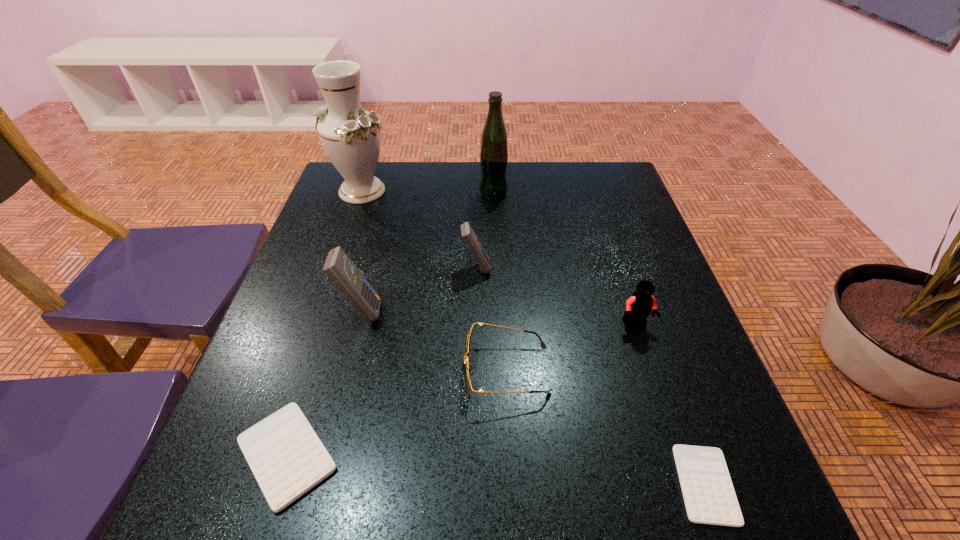
Locate an element on the screen. The image size is (960, 540). object situated at the near left corner is located at coordinates (287, 458).

You are a GUI agent. You are given a task and a screenshot of the screen. Output one action in this format:
    pyautogui.click(x=<x>, y=<y>)
    Task: Click on the object present at the near right corner
    This screenshot has height=540, width=960.
    Given the screenshot: What is the action you would take?
    pyautogui.click(x=709, y=496)

You are a GUI agent. You are given a task and a screenshot of the screen. Output one action in this format:
    pyautogui.click(x=<x>, y=<y>)
    Task: Click on the vacant space at the far edge of the desktop
    
    Given the screenshot: What is the action you would take?
    450,163

Where is `free space at the near edge`? The height and width of the screenshot is (540, 960). free space at the near edge is located at coordinates (507, 516).

In the image, there is a desktop. At what (x,y) coordinates should I click in order to perform the action: click on vacant space at the left edge. Please return your answer as a coordinate pair (x, y). Looking at the image, I should click on (248, 377).

Locate an element on the screen. The width and height of the screenshot is (960, 540). free region at the right edge is located at coordinates (635, 347).

Find the location of a particular element. vacant space at the far left corner of the desktop is located at coordinates (335, 177).

In the image, there is a desktop. What are the coordinates of `free space at the far right corner` in the screenshot? It's located at (627, 198).

Find the location of a particular element. Image resolution: width=960 pixels, height=540 pixels. empty space that is in between the second shortest calculator and the farther blue calculator is located at coordinates (382, 361).

What are the coordinates of `vacant region between the bigger white calculator and the right white calculator` in the screenshot? It's located at click(496, 470).